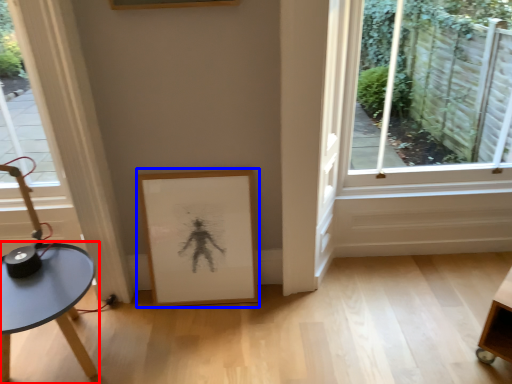
Question: Which object appears farthest to the camera in this image, table (highlighted by a red box) or picture frame (highlighted by a blue box)?

Choices:
 (A) table
 (B) picture frame

Answer: (B)